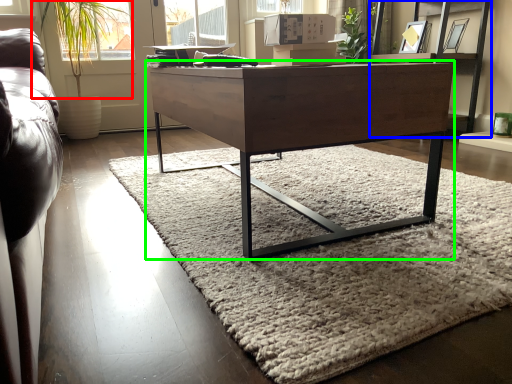
Question: Which object is positioned farthest from plant (highlighted by a red box)? Select from shelf (highlighted by a blue box) and desk (highlighted by a green box).

Choices:
 (A) shelf
 (B) desk

Answer: (A)